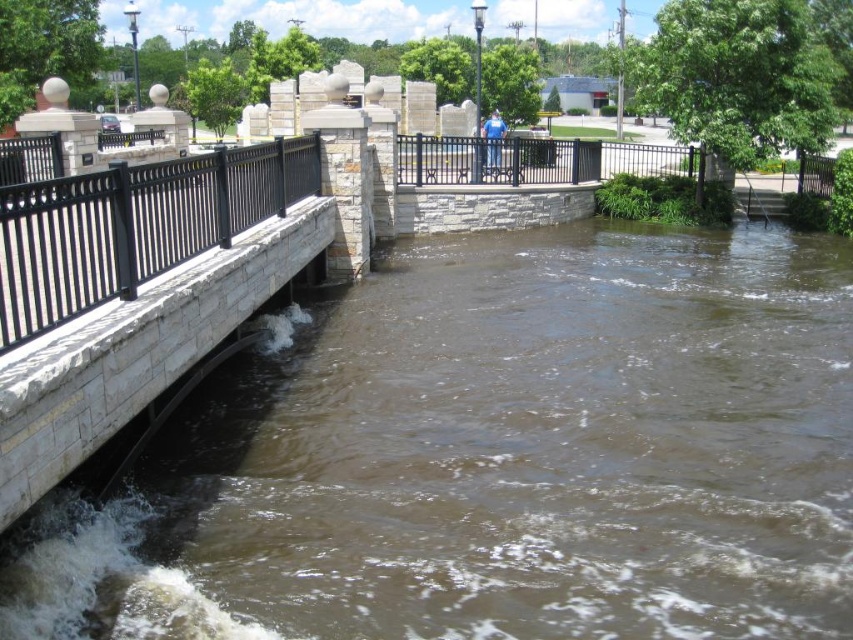
This screenshot has width=853, height=640. I want to click on brown stone river at center, so click(x=496, y=456).

Can you confirm if brown stone river at center is smaller than black metal fence at left?

Incorrect, brown stone river at center is not smaller in size than black metal fence at left.

Identify the location of brown stone river at center. (496, 456).

Which of these two, brown stone river at center or black metal fence at center, stands taller?

brown stone river at center

Is point (743, 284) positioned in front of point (537, 145)?

That is True.

Find the location of a particular element. brown stone river at center is located at coordinates (496, 456).

Is black metal fence at left above black metal fence at center?

No, black metal fence at left is not above black metal fence at center.

Is point (209, 243) positioned after point (675, 152)?

No, it is not.

Locate an element on the screen. Image resolution: width=853 pixels, height=640 pixels. black metal fence at left is located at coordinates (134, 225).